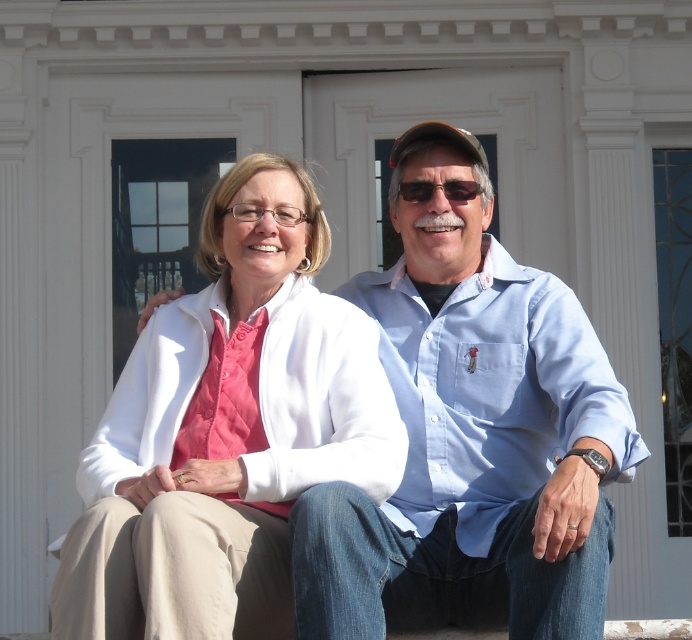
You are a photographer setting up a shot of two people wearing the blue cotton shirt at center and the white matte jacket at center. You want to frame the shot so that the clothing items are clearly visible. Which clothing item should you focus on more to ensure it fits within the frame without being cut off?

The blue cotton shirt at center is wider than the white matte jacket at center, so you should focus more on the blue cotton shirt at center to ensure it fits within the frame without being cut off.

You are a photographer trying to capture a clear shot of the blue cotton shirt at center and the white matte jacket at center. Since the camera can only focus on one object at a time, which one should you choose to ensure it fills the frame more effectively?

The blue cotton shirt at center has a larger size compared to the white matte jacket at center, so you should choose the blue cotton shirt at center to fill the frame more effectively.